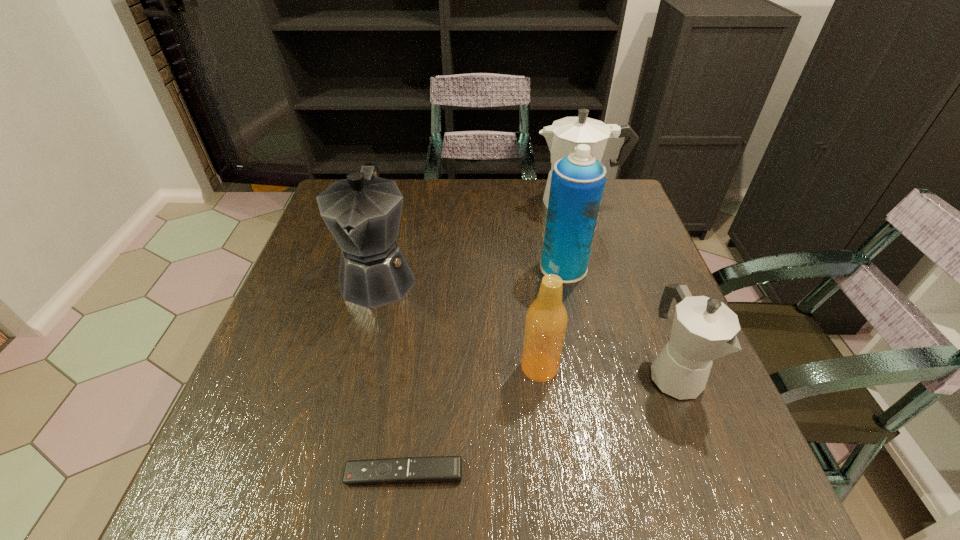
At what (x,y) coordinates should I click in order to perform the action: click on vacant area at the near edge. Please return your answer as a coordinate pair (x, y). The image size is (960, 540). Looking at the image, I should click on (633, 504).

This screenshot has width=960, height=540. I want to click on blank area at the left edge, so click(243, 450).

Identify the location of free space at the right edge. (647, 440).

The height and width of the screenshot is (540, 960). In order to click on blank space at the near left corner in this screenshot , I will do `click(287, 483)`.

Where is `vacant area that lies between the farthest coffeepot and the nearest object`? Image resolution: width=960 pixels, height=540 pixels. vacant area that lies between the farthest coffeepot and the nearest object is located at coordinates 491,338.

This screenshot has width=960, height=540. I want to click on free space between the nearest object and the beer bottle, so click(x=471, y=420).

This screenshot has height=540, width=960. In order to click on vacant area that lies between the shortest object and the shortest coffeepot in this screenshot , I will do `click(540, 424)`.

You are a GUI agent. You are given a task and a screenshot of the screen. Output one action in this format:
    pyautogui.click(x=<x>, y=<y>)
    Task: Click on the free space between the shortest coffeepot and the aerosol can
    
    Given the screenshot: What is the action you would take?
    (619, 321)

The height and width of the screenshot is (540, 960). In order to click on vacant space in between the shortest object and the nearest coffeepot in this screenshot , I will do `click(540, 424)`.

At what (x,y) coordinates should I click in order to perform the action: click on unoccupied area between the remote control and the aerosol can. Please return your answer as a coordinate pair (x, y). Image resolution: width=960 pixels, height=540 pixels. Looking at the image, I should click on (484, 370).